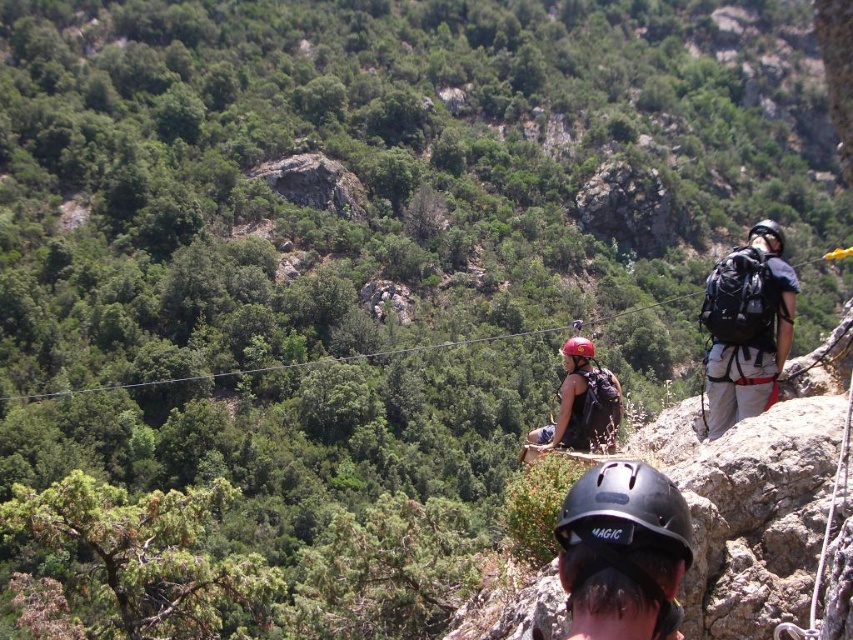
Question: Does matte black backpack at right appear on the left side of black matte helmet at upper right?

Choices:
 (A) yes
 (B) no

Answer: (A)

Question: Based on their relative distances, which object is farther from the red matte helmet at center?

Choices:
 (A) black matte helmet at upper right
 (B) matte black backpack at right

Answer: (A)

Question: Which of the following is the farthest from the observer?

Choices:
 (A) (733, 397)
 (B) (769, 237)
 (C) (569, 369)
 (D) (630, 531)

Answer: (C)

Question: Does matte black backpack at right have a lesser width compared to red matte helmet at center?

Choices:
 (A) no
 (B) yes

Answer: (B)

Question: Which object is the closest to the black matte helmet at upper right?

Choices:
 (A) black matte helmet at center
 (B) matte black backpack at right
 (C) red matte helmet at center

Answer: (A)

Question: Where is matte black backpack at right located in relation to black matte helmet at upper right in the image?

Choices:
 (A) left
 (B) right

Answer: (A)